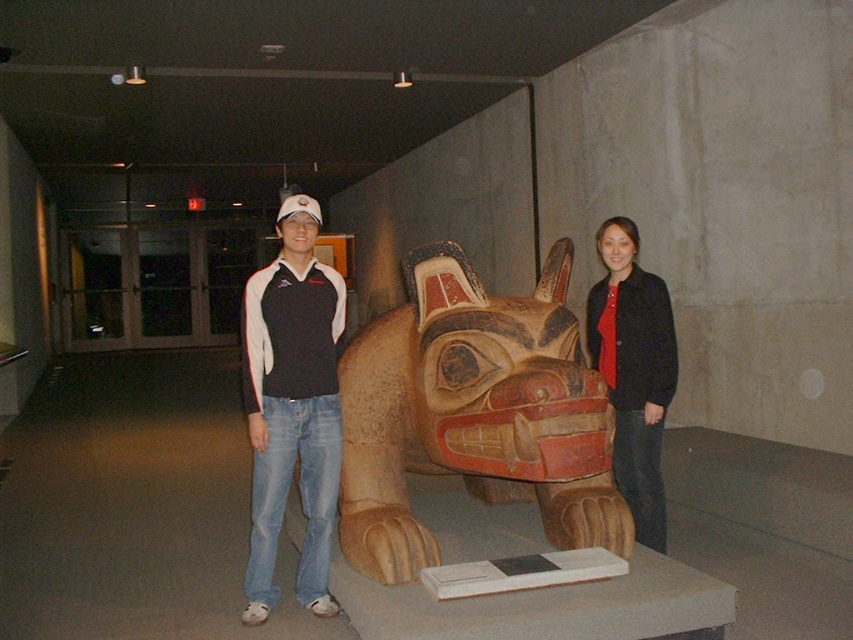
You are a fashion designer observing two items at a center position in a museum. You need to determine which item is taller between the matte black shirt at center and the matte black jacket at center. Which one is taller?

The matte black shirt at center is taller than the matte black jacket at center according to the description.

You are standing in the museum and want to take a photo of the wooden totem pole at center. The camera you are using has a 50mm lens, which has a field of view of 46 degrees. You are currently at the point marked by coordinates point (473, 413). Is the wooden totem pole at center within your camera lens field of view?

The point (473, 413) marks the wooden totem pole at center, so the camera is directly aimed at the wooden totem pole at center. Since the camera is pointed at the totem pole, it is within the field of view of the 50mm lens.